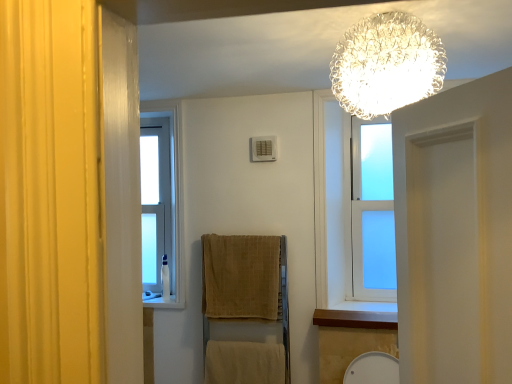
Question: From the image's perspective, is wooden at lower right located above or below beige cotton towel at lower center, placed as the first bath towel when sorted from bottom to top?

Choices:
 (A) above
 (B) below

Answer: (A)

Question: Based on their sizes in the image, would you say wooden at lower right is bigger or smaller than beige cotton towel at lower center, placed as the first bath towel when sorted from bottom to top?

Choices:
 (A) big
 (B) small

Answer: (B)

Question: Estimate the real-world distances between objects in this image. Which object is farther from the wooden at lower right?

Choices:
 (A) clear glass window at left
 (B) beige textured towel at center, positioned as the 2th bath towel in bottom-to-top order
 (C) crystalline glass chandelier at upper center
 (D) beige cotton towel at lower center, placed as the first bath towel when sorted from bottom to top
 (E) white plastic toiletry at left

Answer: (C)

Question: Based on their relative distances, which object is nearer to the wooden at lower right?

Choices:
 (A) beige cotton towel at lower center, placed as the first bath towel when sorted from bottom to top
 (B) clear glass window at left
 (C) beige textured towel at center, positioned as the 2th bath towel in bottom-to-top order
 (D) crystalline glass chandelier at upper center
 (E) white plastic toiletry at left

Answer: (C)